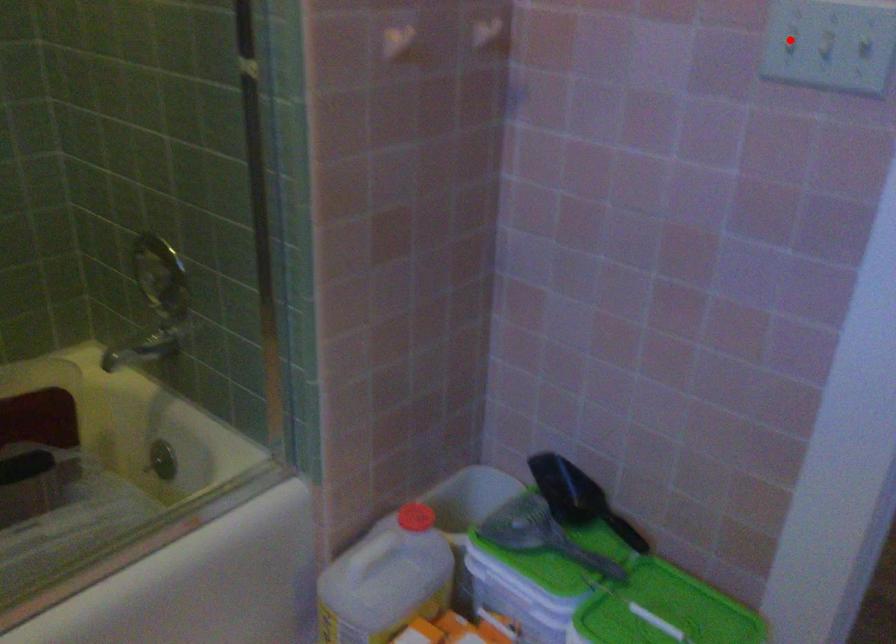
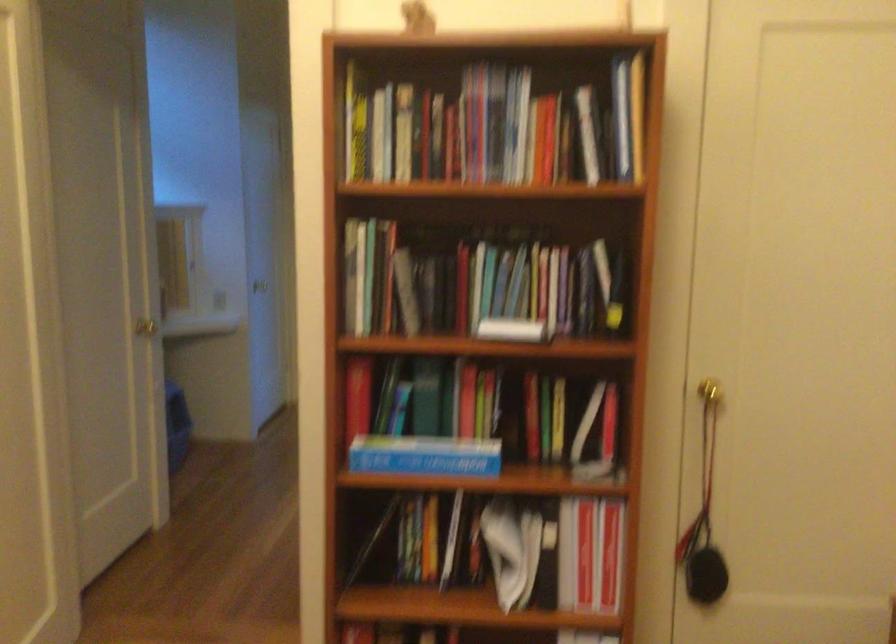
Question: I am providing you with two images of the same scene from different viewpoints. A red point is marked on the first image. Is the red point's position out of view in image 2?

Choices:
 (A) Yes
 (B) No

Answer: (A)